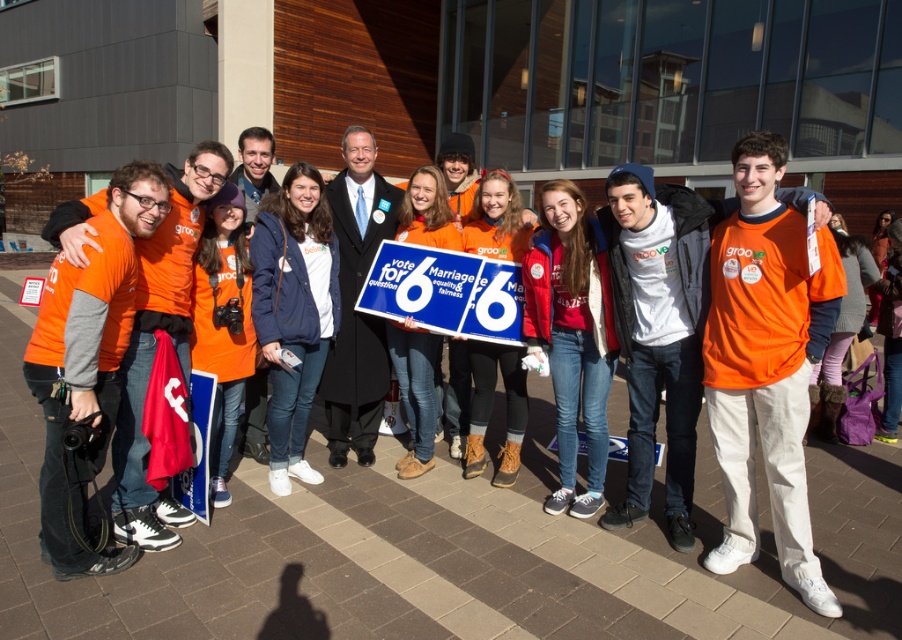
You are a photographer trying to capture a group photo of the red fleece jacket at center and the matte orange shirt at center. You want to ensure both are fully visible in the frame. Which object should you adjust your camera angle to focus on first to accommodate their widths?

The red fleece jacket at center might be wider than matte orange shirt at center, so you should focus on the red fleece jacket at center first to ensure it fits within the frame before adjusting for the matte orange shirt at center.

You are a photographer at the event and want to capture a photo where the white plastic sign at center is clearly visible without being covered by the matte orange shirt at center. Given their sizes, is this possible?

The white plastic sign at center is smaller than the matte orange shirt at center, so it might be challenging to ensure the sign is not covered by the shirt. Adjusting the angle or position of the shirt could help make the sign visible.